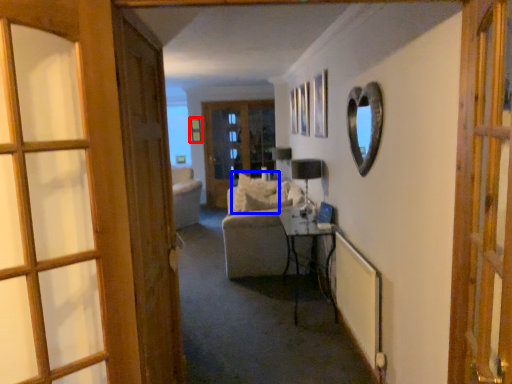
Question: Which point is further to the camera, picture frame (highlighted by a red box) or pillow (highlighted by a blue box)?

Choices:
 (A) picture frame
 (B) pillow

Answer: (A)